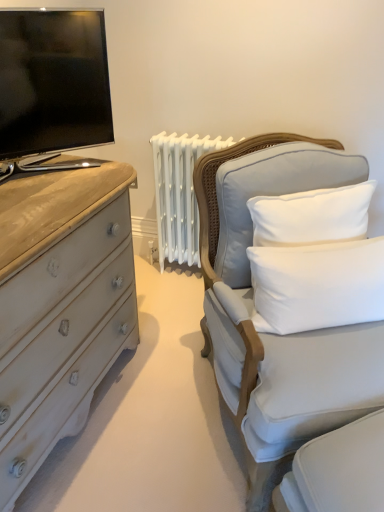
Question: Is matte black screen at upper left positioned with its back to white cotton pillow at upper right, the 1th pillow positioned from the top?

Choices:
 (A) yes
 (B) no

Answer: (B)

Question: Are matte black screen at upper left and white cotton pillow at upper right, the 2th pillow ordered from the bottom, located far from each other?

Choices:
 (A) no
 (B) yes

Answer: (A)

Question: Does matte black screen at upper left have a larger size compared to white cotton pillow at upper right, the 2th pillow ordered from the bottom?

Choices:
 (A) yes
 (B) no

Answer: (A)

Question: From the image's perspective, is matte black screen at upper left on top of white cotton pillow at upper right, the 2th pillow ordered from the bottom?

Choices:
 (A) no
 (B) yes

Answer: (B)

Question: Does matte black screen at upper left have a lesser width compared to white cotton pillow at upper right, the 2th pillow ordered from the bottom?

Choices:
 (A) yes
 (B) no

Answer: (B)

Question: Is matte black screen at upper left completely or partially outside of white cotton pillow at upper right, the 2th pillow ordered from the bottom?

Choices:
 (A) yes
 (B) no

Answer: (A)

Question: Considering the relative positions of matte black screen at upper left and white soft cushion at right, arranged as the 1th pillow when ordered from the bottom, in the image provided, is matte black screen at upper left to the right of white soft cushion at right, arranged as the 1th pillow when ordered from the bottom, from the viewer's perspective?

Choices:
 (A) no
 (B) yes

Answer: (A)

Question: Could white soft cushion at right, arranged as the 1th pillow when ordered from the bottom, be considered to be inside matte black screen at upper left?

Choices:
 (A) yes
 (B) no

Answer: (B)

Question: From a real-world perspective, is matte black screen at upper left located beneath white soft cushion at right, the second pillow when ordered from top to bottom?

Choices:
 (A) yes
 (B) no

Answer: (B)

Question: Is matte black screen at upper left taller than white soft cushion at right, arranged as the 1th pillow when ordered from the bottom?

Choices:
 (A) no
 (B) yes

Answer: (B)

Question: Would you say matte black screen at upper left is a long distance from white soft cushion at right, the second pillow when ordered from top to bottom?

Choices:
 (A) no
 (B) yes

Answer: (A)

Question: Is matte black screen at upper left further to camera compared to white soft cushion at right, arranged as the 1th pillow when ordered from the bottom?

Choices:
 (A) yes
 (B) no

Answer: (B)

Question: Considering the relative sizes of white cotton pillow at upper right, the 1th pillow positioned from the top, and white soft cushion at right, arranged as the 1th pillow when ordered from the bottom, in the image provided, is white cotton pillow at upper right, the 1th pillow positioned from the top, smaller than white soft cushion at right, arranged as the 1th pillow when ordered from the bottom,?

Choices:
 (A) yes
 (B) no

Answer: (B)